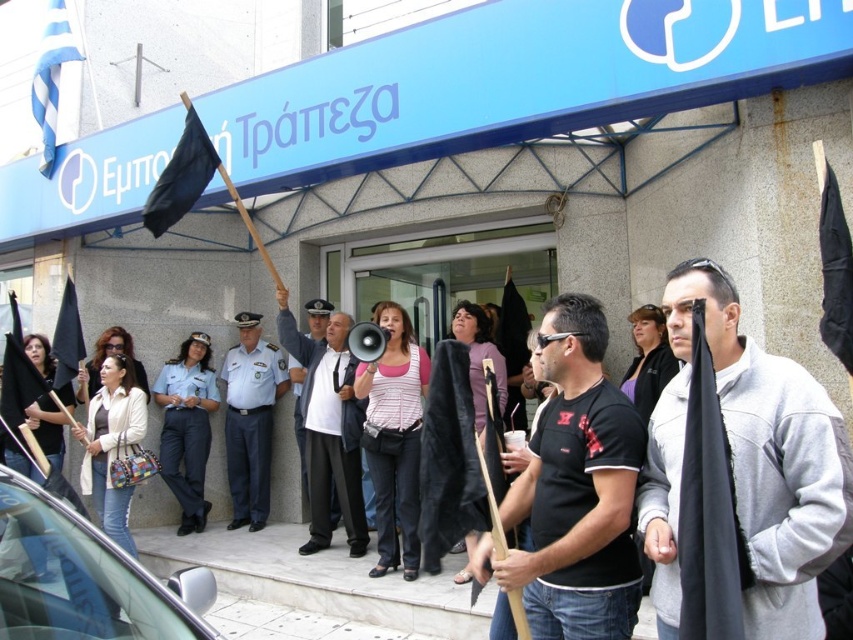
Does light blue uniform at center come behind black fabric flag at upper left?

Yes, light blue uniform at center is behind black fabric flag at upper left.

Who is more forward, (244,332) or (160,186)?

Point (160,186) is more forward.

Who is more distant from viewer, (236, 484) or (190, 116)?

Positioned behind is point (236, 484).

Image resolution: width=853 pixels, height=640 pixels. I want to click on light blue uniform at center, so click(x=250, y=419).

Who is more forward, (758, 552) or (320, 464)?

Positioned in front is point (758, 552).

Between gray matte jacket at center and white shirt at center, which one appears on the right side from the viewer's perspective?

Positioned to the right is gray matte jacket at center.

The height and width of the screenshot is (640, 853). In order to click on gray matte jacket at center in this screenshot , I will do `click(749, 465)`.

What are the coordinates of `gray matte jacket at center` in the screenshot? It's located at (749, 465).

Who is more distant from viewer, [577,588] or [260,388]?

The point [260,388] is behind.

Can you confirm if black matte shirt at center is smaller than light blue uniform at center?

Indeed, black matte shirt at center has a smaller size compared to light blue uniform at center.

Between point (619, 451) and point (236, 435), which one is positioned in front?

Point (619, 451) is more forward.

In order to click on black matte shirt at center in this screenshot , I will do coord(575,490).